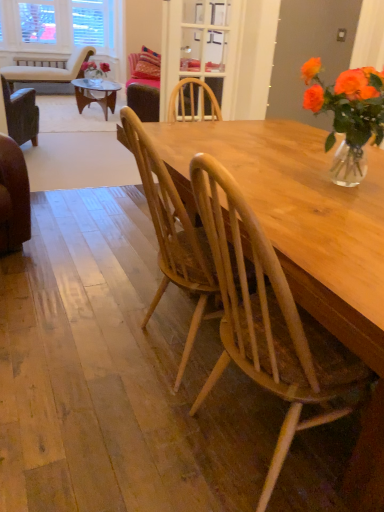
Find the location of a particular element. This screenshot has height=512, width=384. light brown wood chair at center, the 2th chair when ordered from front to back is located at coordinates (172, 234).

What are the coordinates of `translucent glass vase at upper right` in the screenshot? It's located at (348, 115).

What do you see at coordinates (199, 47) in the screenshot? This screenshot has width=384, height=512. I see `clear glass door at upper center` at bounding box center [199, 47].

Describe the element at coordinates (49, 70) in the screenshot. This screenshot has height=512, width=384. I see `beige fabric chair at upper left, the third chair ordered from the bottom` at that location.

The image size is (384, 512). Find the location of `beige fabric chair at upper left, which ranks as the third chair in right-to-left order`. beige fabric chair at upper left, which ranks as the third chair in right-to-left order is located at coordinates (49, 70).

The height and width of the screenshot is (512, 384). Find the location of `light brown wood chair at center, which appears as the 2th chair when ordered from the bottom`. light brown wood chair at center, which appears as the 2th chair when ordered from the bottom is located at coordinates (172, 234).

Is the position of light brown wood chair at center, which appears as the second chair when viewed from the back, less distant than that of translucent glass vase at upper right?

No, light brown wood chair at center, which appears as the second chair when viewed from the back, is further to the viewer.

Would you say light brown wood chair at center, the 2th chair viewed from the right, is outside translucent glass vase at upper right?

light brown wood chair at center, the 2th chair viewed from the right, is positioned outside translucent glass vase at upper right.

From the image's perspective, is light brown wood chair at center, the 2th chair when ordered from front to back, beneath translucent glass vase at upper right?

Yes, from the image's perspective, light brown wood chair at center, the 2th chair when ordered from front to back, is below translucent glass vase at upper right.

From the picture: How many degrees apart are the facing directions of light brown wood chair at center, the 2th chair when ordered from front to back, and translucent glass vase at upper right?

91.4 degrees separate the facing orientations of light brown wood chair at center, the 2th chair when ordered from front to back, and translucent glass vase at upper right.

Locate an element on the screen. The height and width of the screenshot is (512, 384). glass door above the translucent glass vase at upper right (from a real-world perspective) is located at coordinates (199, 47).

Based on the photo, from a real-world perspective, between translucent glass vase at upper right and clear glass door at upper center, who is vertically lower?

translucent glass vase at upper right, from a real-world perspective.

Is point (356, 95) more distant than point (184, 51)?

No.

Consider the image. Is translucent glass vase at upper right oriented away from clear glass door at upper center?

No, translucent glass vase at upper right's orientation is not away from clear glass door at upper center.

Is light brown wood chair at center, which appears as the second chair when viewed from the back, facing away from beige fabric chair at upper left, which ranks as the third chair in right-to-left order?

That's not correct — light brown wood chair at center, which appears as the second chair when viewed from the back, is not looking away from beige fabric chair at upper left, which ranks as the third chair in right-to-left order.

Is light brown wood chair at center, which appears as the 2th chair when ordered from the bottom, taller or shorter than beige fabric chair at upper left, the first chair from the left?

In the image, light brown wood chair at center, which appears as the 2th chair when ordered from the bottom, appears to be taller than beige fabric chair at upper left, the first chair from the left.

Which is correct: light brown wood chair at center, which appears as the 2th chair when ordered from the bottom, is inside beige fabric chair at upper left, the 1th chair viewed from the back, or outside of it?

light brown wood chair at center, which appears as the 2th chair when ordered from the bottom, is not enclosed by beige fabric chair at upper left, the 1th chair viewed from the back.

From the image's perspective, which one is positioned lower, light brown wood chair at center, the 2th chair when ordered from front to back, or beige fabric chair at upper left, the 1th chair viewed from the back?

light brown wood chair at center, the 2th chair when ordered from front to back.

Is natural wood chair at center, the third chair in the top-to-bottom sequence, shorter than clear glass door at upper center?

Incorrect, the height of natural wood chair at center, the third chair in the top-to-bottom sequence, does not fall short of that of clear glass door at upper center.

Considering the relative positions of natural wood chair at center, which appears as the 1th chair when viewed from the right, and clear glass door at upper center in the image provided, is natural wood chair at center, which appears as the 1th chair when viewed from the right, to the left or to the right of clear glass door at upper center?

natural wood chair at center, which appears as the 1th chair when viewed from the right, is positioned on clear glass door at upper center's right side.

From a real-world perspective, is natural wood chair at center, placed as the 1th chair when sorted from front to back, positioned under clear glass door at upper center based on gravity?

Yes.

Which is behind, natural wood chair at center, the first chair when ordered from bottom to top, or clear glass door at upper center?

clear glass door at upper center is further away from the camera.

From the image's perspective, is light brown wood chair at center, which appears as the second chair when viewed from the back, above or below clear glass door at upper center?

From the image's perspective, light brown wood chair at center, which appears as the second chair when viewed from the back, appears below clear glass door at upper center.

Can you tell me how much light brown wood chair at center, which appears as the second chair when viewed from the left, and clear glass door at upper center differ in facing direction?

The angular difference between light brown wood chair at center, which appears as the second chair when viewed from the left, and clear glass door at upper center is 88.5 degrees.

From the picture: Considering the relative sizes of light brown wood chair at center, the 2th chair viewed from the right, and clear glass door at upper center in the image provided, is light brown wood chair at center, the 2th chair viewed from the right, wider than clear glass door at upper center?

Yes.

Can you confirm if light brown wood chair at center, the 2th chair when ordered from top to bottom, is shorter than clear glass door at upper center?

No.

Which point is more forward, (x=287, y=313) or (x=58, y=70)?

Point (x=287, y=313)

Is natural wood chair at center, which appears as the 3th chair when viewed from the back, oriented away from beige fabric chair at upper left, the first chair from the left?

No, beige fabric chair at upper left, the first chair from the left, is not at the back of natural wood chair at center, which appears as the 3th chair when viewed from the back.

Is natural wood chair at center, which appears as the 3th chair when viewed from the back, far from beige fabric chair at upper left, positioned as the third chair in front-to-back order?

Yes, natural wood chair at center, which appears as the 3th chair when viewed from the back, and beige fabric chair at upper left, positioned as the third chair in front-to-back order, are located far from each other.

From the image's perspective, is natural wood chair at center, placed as the 3th chair when sorted from left to right, located beneath beige fabric chair at upper left, which ranks as the first chair in top-to-bottom order?

Indeed, from the image's perspective, natural wood chair at center, placed as the 3th chair when sorted from left to right, is shown beneath beige fabric chair at upper left, which ranks as the first chair in top-to-bottom order.

Is point (169, 188) less distant than point (339, 361)?

No, it is not.

Considering the positions of objects light brown wood chair at center, which appears as the second chair when viewed from the back, and natural wood chair at center, placed as the 3th chair when sorted from left to right, in the image provided, who is behind, light brown wood chair at center, which appears as the second chair when viewed from the back, or natural wood chair at center, placed as the 3th chair when sorted from left to right,?

light brown wood chair at center, which appears as the second chair when viewed from the back, is further away from the camera.

Looking at this image, which of these two, light brown wood chair at center, which appears as the second chair when viewed from the left, or natural wood chair at center, placed as the 1th chair when sorted from front to back, is wider?

With larger width is light brown wood chair at center, which appears as the second chair when viewed from the left.

The image size is (384, 512). I want to click on the 1st chair to the left of the natural wood chair at center, the third chair in the top-to-bottom sequence, starting your count from the anchor, so click(x=172, y=234).

Find the location of a particular element. the 1st chair below when counting from the translucent glass vase at upper right (from the image's perspective) is located at coordinates (172, 234).

At what (x,y) coordinates should I click in order to perform the action: click on floral arrangement lying on the right of clear glass door at upper center. Please return your answer as a coordinate pair (x, y). This screenshot has width=384, height=512. Looking at the image, I should click on (348, 115).

Looking at the image, which one is located further to translucent glass vase at upper right, beige fabric chair at upper left, which ranks as the third chair in right-to-left order, or natural wood chair at center, which appears as the 1th chair when viewed from the right?

beige fabric chair at upper left, which ranks as the third chair in right-to-left order, is positioned further to the anchor translucent glass vase at upper right.

Considering their positions, is beige fabric chair at upper left, the first chair from the left, positioned closer to natural wood chair at center, placed as the 1th chair when sorted from front to back, than light brown wood chair at center, the 2th chair when ordered from front to back?

light brown wood chair at center, the 2th chair when ordered from front to back, is closer to natural wood chair at center, placed as the 1th chair when sorted from front to back.

In the scene shown: Estimate the real-world distances between objects in this image. Which object is closer to natural wood chair at center, which appears as the 3th chair when viewed from the back, light brown wood chair at center, which appears as the second chair when viewed from the left, or clear glass door at upper center?

light brown wood chair at center, which appears as the second chair when viewed from the left, is positioned closer to the anchor natural wood chair at center, which appears as the 3th chair when viewed from the back.

In the scene shown: Which object lies further to the anchor point light brown wood chair at center, which appears as the second chair when viewed from the left, natural wood chair at center, which appears as the 3th chair when viewed from the back, or translucent glass vase at upper right?

Among the two, translucent glass vase at upper right is located further to light brown wood chair at center, which appears as the second chair when viewed from the left.

When comparing their distances from beige fabric chair at upper left, the 1th chair viewed from the back, does light brown wood chair at center, the 2th chair when ordered from top to bottom, or natural wood chair at center, which appears as the 3th chair when viewed from the back, seem closer?

Based on the image, light brown wood chair at center, the 2th chair when ordered from top to bottom, appears to be nearer to beige fabric chair at upper left, the 1th chair viewed from the back.

From the image, which object appears to be nearer to beige fabric chair at upper left, positioned as the third chair in front-to-back order, translucent glass vase at upper right or clear glass door at upper center?

The object closer to beige fabric chair at upper left, positioned as the third chair in front-to-back order, is clear glass door at upper center.

Based on the photo, when comparing their distances from translucent glass vase at upper right, does light brown wood chair at center, the 2th chair viewed from the right, or clear glass door at upper center seem closer?

light brown wood chair at center, the 2th chair viewed from the right.

From the image, which object appears to be nearer to natural wood chair at center, placed as the 1th chair when sorted from front to back, clear glass door at upper center or beige fabric chair at upper left, positioned as the third chair in front-to-back order?

Among the two, clear glass door at upper center is located nearer to natural wood chair at center, placed as the 1th chair when sorted from front to back.

Identify the location of glass door between natural wood chair at center, placed as the 3th chair when sorted from left to right, and beige fabric chair at upper left, the third chair ordered from the bottom, from front to back. This screenshot has width=384, height=512. coord(199,47).

Where is `glass door positioned between light brown wood chair at center, the 2th chair when ordered from front to back, and beige fabric chair at upper left, the first chair from the left, from near to far`? glass door positioned between light brown wood chair at center, the 2th chair when ordered from front to back, and beige fabric chair at upper left, the first chair from the left, from near to far is located at coordinates (199, 47).

Where is `chair between translucent glass vase at upper right and natural wood chair at center, the third chair in the top-to-bottom sequence, vertically`? The width and height of the screenshot is (384, 512). chair between translucent glass vase at upper right and natural wood chair at center, the third chair in the top-to-bottom sequence, vertically is located at coordinates (172, 234).

Locate an element on the screen. The image size is (384, 512). chair positioned between translucent glass vase at upper right and clear glass door at upper center from near to far is located at coordinates (172, 234).